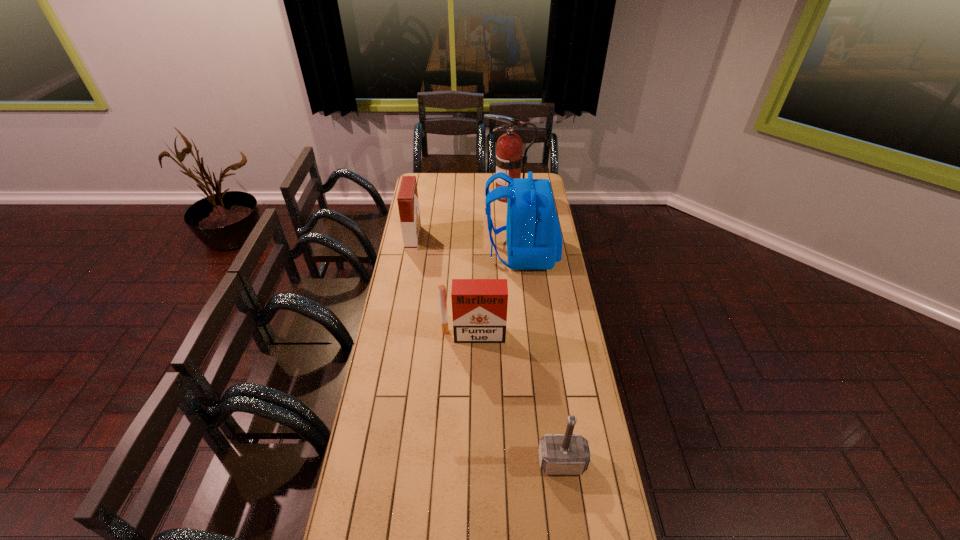
Find the location of `hammer that is at the right edge`. hammer that is at the right edge is located at coordinates (559, 454).

Where is `object at the far right corner`? The image size is (960, 540). object at the far right corner is located at coordinates (508, 159).

Where is `vacant space at the left edge`? vacant space at the left edge is located at coordinates (390, 316).

In the image, there is a desktop. Where is `free region at the right edge`? Image resolution: width=960 pixels, height=540 pixels. free region at the right edge is located at coordinates (548, 362).

Image resolution: width=960 pixels, height=540 pixels. Find the location of `vacant space at the far right corner`. vacant space at the far right corner is located at coordinates (542, 173).

The image size is (960, 540). What are the coordinates of `free space between the backpack and the leftmost object` in the screenshot? It's located at (467, 246).

What are the coordinates of `empty location between the nearest object and the right cigarette case` in the screenshot? It's located at (517, 399).

Where is `vacant space in between the nearest object and the fourth shortest object`? This screenshot has height=540, width=960. vacant space in between the nearest object and the fourth shortest object is located at coordinates (541, 357).

Image resolution: width=960 pixels, height=540 pixels. What are the coordinates of `object that stands as the closest to the second tallest object` in the screenshot? It's located at (508, 159).

Identify which object is located as the nearest to the nearer cigarette case. Please provide its 2D coordinates. Your answer should be formatted as a tuple, i.e. [(x, y)], where the tuple contains the x and y coordinates of a point satisfying the conditions above.

[(534, 241)]